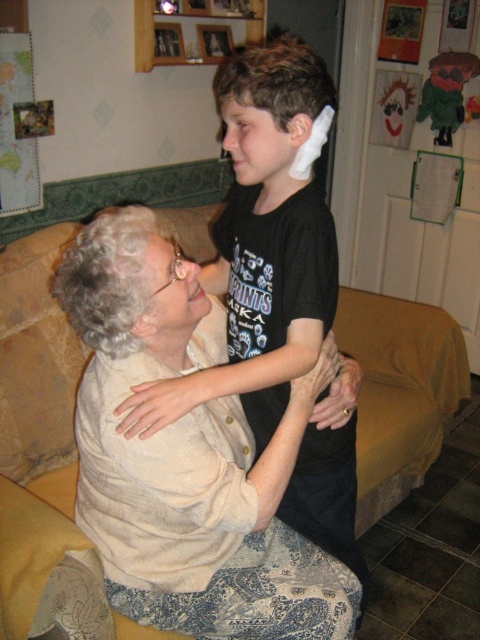
Question: Which of the following is the farthest from the observer?

Choices:
 (A) black matte shirt at upper center
 (B) light beige fabric at center

Answer: (B)

Question: Does light beige fabric at center appear over black matte shirt at upper center?

Choices:
 (A) no
 (B) yes

Answer: (A)

Question: Can you confirm if light beige fabric at center is smaller than black matte shirt at upper center?

Choices:
 (A) yes
 (B) no

Answer: (A)

Question: Can you confirm if light beige fabric at center is positioned below black matte shirt at upper center?

Choices:
 (A) yes
 (B) no

Answer: (A)